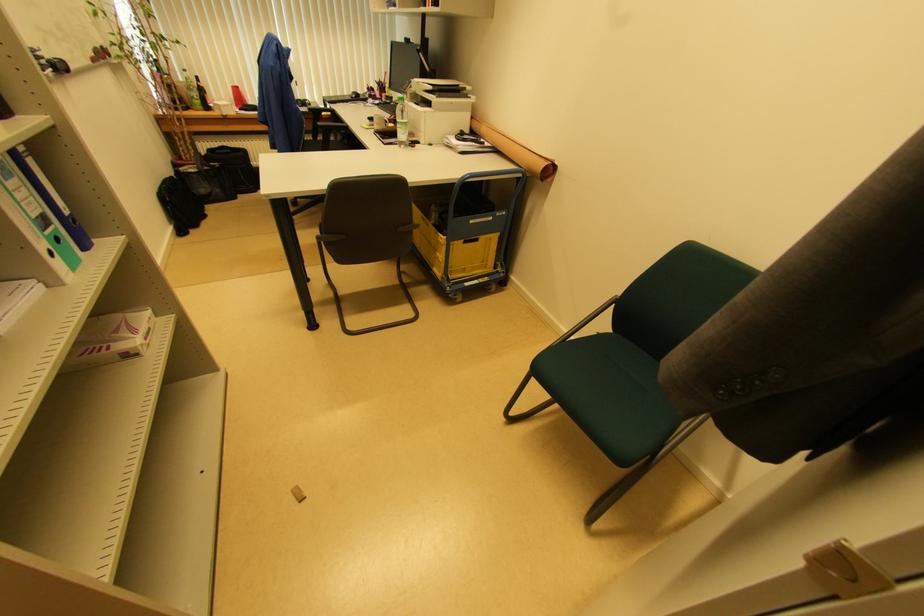
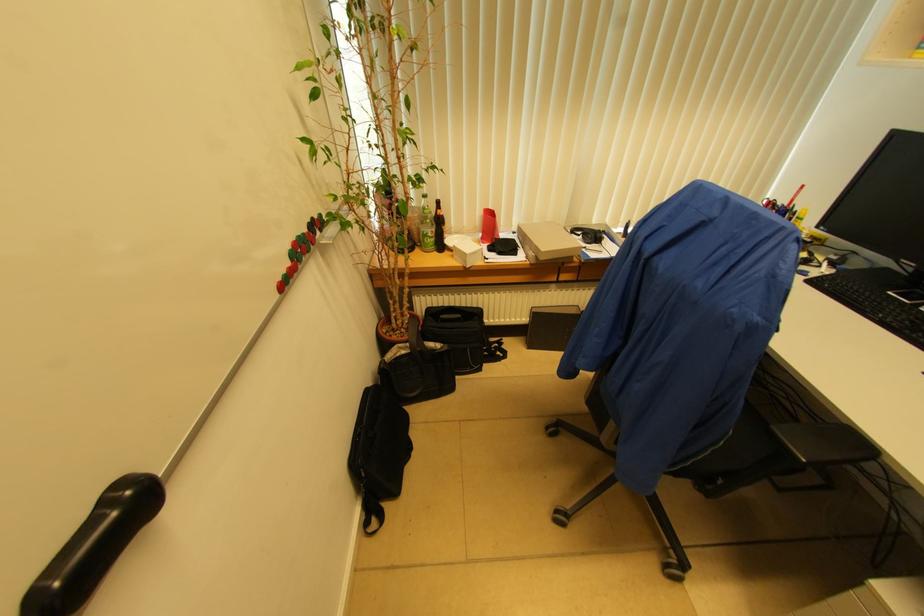
In a continuous first-person perspective shot, in which direction is the camera moving?

The cameraman moved toward left, forward.